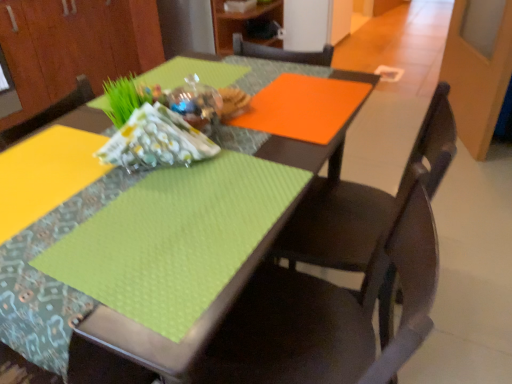
Question: Would you say patterned fabric at center is to the left or to the right of matte wood cabinet at upper left, the second cabinetry positioned from the right, in the picture?

Choices:
 (A) left
 (B) right

Answer: (B)

Question: In terms of width, does patterned fabric at center look wider or thinner when compared to matte wood cabinet at upper left, which is the 1th cabinetry from left to right?

Choices:
 (A) wide
 (B) thin

Answer: (B)

Question: Estimate the real-world distances between objects in this image. Which object is farther from the matte black chair at center, the first chair from the back?

Choices:
 (A) matte wood cabinet at upper center, which appears as the 2th cabinetry when viewed from the left
 (B) patterned fabric at center
 (C) matte green placemat at lower left, positioned as the first chair in front-to-back order
 (D) matte wood cabinet at upper left, which is the 1th cabinetry from left to right

Answer: (D)

Question: Estimate the real-world distances between objects in this image. Which object is closer to the matte wood cabinet at upper center, which appears as the first cabinetry when viewed from the right?

Choices:
 (A) matte black chair at center, the first chair from the back
 (B) patterned fabric at center
 (C) matte wood cabinet at upper left, the second cabinetry positioned from the right
 (D) matte green placemat at lower left, which appears as the second chair when viewed from the back

Answer: (C)